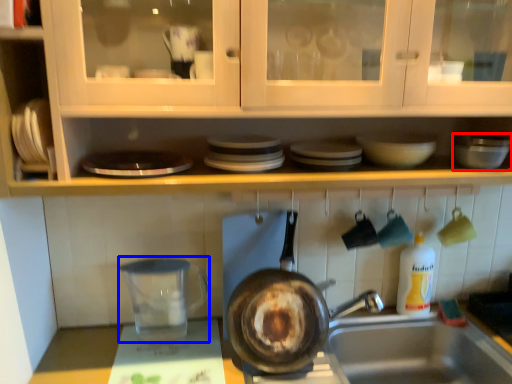
Question: Which of the following is the closest to the observer, mixing bowl (highlighted by a red box) or appliance (highlighted by a blue box)?

Choices:
 (A) mixing bowl
 (B) appliance

Answer: (A)